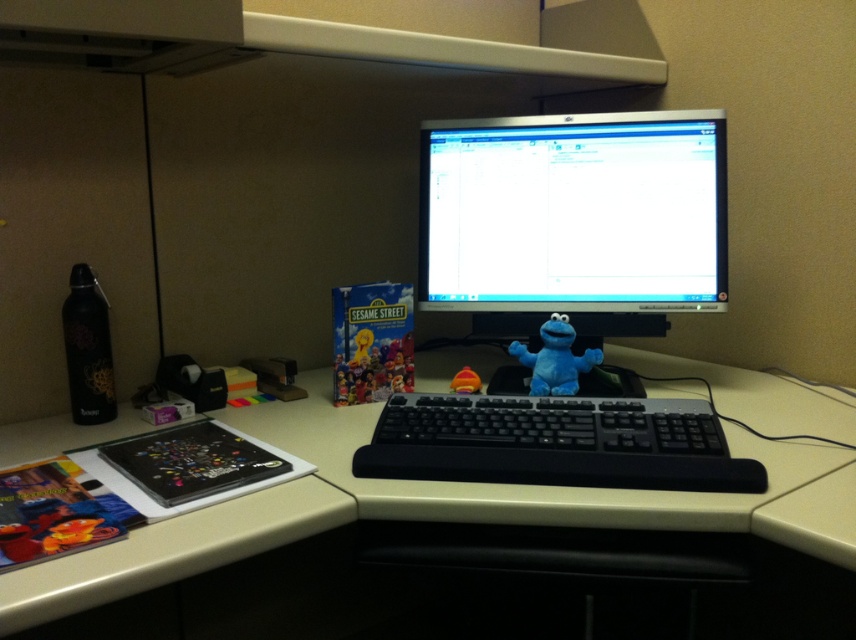
You are setting up a new monitor on your desk. You have a matte black monitor at center and a black plastic keyboard at center. If you want to place the new monitor to the right of the existing one, will there be enough space if the keyboard is already occupying the right side?

The matte black monitor at center might be wider than black plastic keyboard at center, so placing the new monitor to the right may not be possible if the existing monitor is wider than the keyboard and the keyboard is already on the right side.

You are looking at the workspace setup and want to place a new item between the two points, point (489,224) and point (521,355). Since you want the item to be visible from your current viewpoint, which point should the item be closer to?

The item should be placed closer to point (489,224) because it is closer to the camera, ensuring the item remains visible from your current viewpoint.

You are standing in front of the workspace and want to reach the point at coordinates point (673, 204). If your arm can extend 1.2 meters, can you reach it without moving your body?

The distance between you and point (673, 204) is 1.30 meters, which is slightly longer than your arm extension of 1.2 meters. Therefore, you cannot reach it without moving your body.